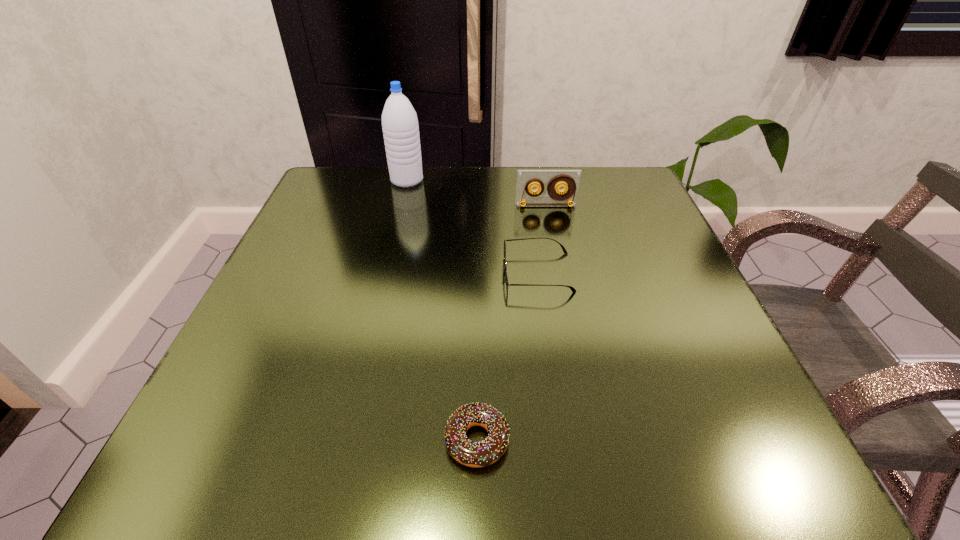
I want to click on vacant space situated 0.150m on the front-facing side of the spectacles, so click(421, 272).

Identify the location of free location located on the front-facing side of the spectacles. The image size is (960, 540). (320, 272).

Where is `free space located on the right of the second object from left to right`? free space located on the right of the second object from left to right is located at coordinates (755, 440).

What are the coordinates of `water bottle positioned at the far edge` in the screenshot? It's located at (400, 127).

At what (x,y) coordinates should I click in order to perform the action: click on videotape that is at the far edge. Please return your answer as a coordinate pair (x, y). Looking at the image, I should click on (526, 179).

At what (x,y) coordinates should I click in order to perform the action: click on object situated at the near edge. Please return your answer as a coordinate pair (x, y). Looking at the image, I should click on (472, 454).

Find the location of a particular element. free location at the far edge of the desktop is located at coordinates (438, 190).

Identify the location of free space at the near edge of the desktop. (461, 475).

Image resolution: width=960 pixels, height=540 pixels. In the image, there is a desktop. In order to click on vacant space at the left edge in this screenshot , I will do `click(301, 389)`.

You are a GUI agent. You are given a task and a screenshot of the screen. Output one action in this format:
    pyautogui.click(x=<x>, y=<y>)
    Task: Click on the vacant space at the right edge
    This screenshot has width=960, height=540.
    Given the screenshot: What is the action you would take?
    pyautogui.click(x=632, y=288)